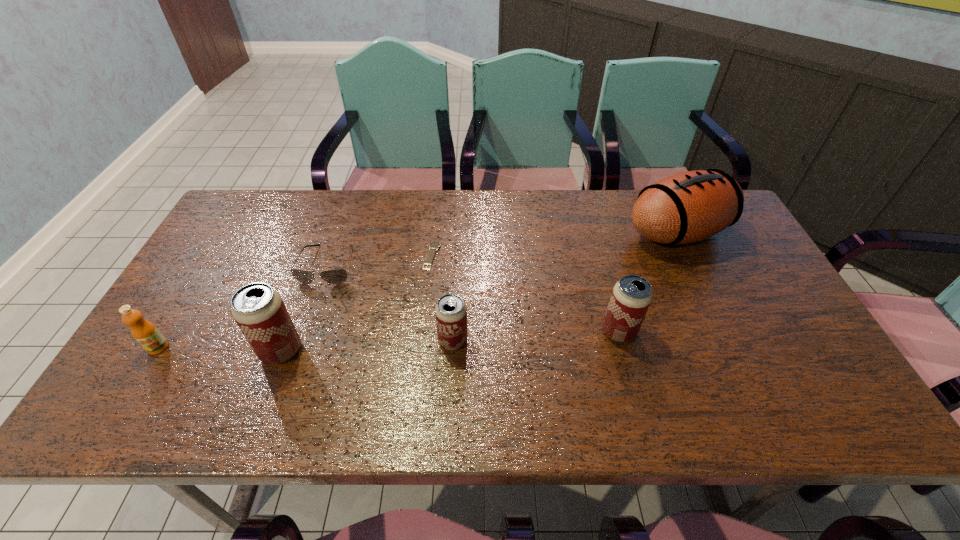
Where is `the leftmost beer can`? The image size is (960, 540). the leftmost beer can is located at coordinates (259, 311).

You are a GUI agent. You are given a task and a screenshot of the screen. Output one action in this format:
    pyautogui.click(x=<x>, y=<y>)
    Task: Click on the fifth object from left to right
    
    Given the screenshot: What is the action you would take?
    pyautogui.click(x=451, y=313)

At what (x,y) coordinates should I click in order to perform the action: click on the shortest beer can. Please return your answer as a coordinate pair (x, y). Looking at the image, I should click on (451, 313).

Locate an element on the screen. This screenshot has height=540, width=960. the rightmost beer can is located at coordinates (631, 296).

You are a GUI agent. You are given a task and a screenshot of the screen. Output one action in this format:
    pyautogui.click(x=<x>, y=<y>)
    Task: Click on the second shortest beer can
    Image resolution: width=960 pixels, height=540 pixels.
    Given the screenshot: What is the action you would take?
    pyautogui.click(x=631, y=296)

You are a GUI agent. You are given a task and a screenshot of the screen. Output one action in this format:
    pyautogui.click(x=<x>, y=<y>)
    Task: Click on the watch
    The height and width of the screenshot is (540, 960).
    Given the screenshot: What is the action you would take?
    pyautogui.click(x=434, y=245)

I want to click on the shortest object, so click(434, 245).

Find the location of `football (American)`. football (American) is located at coordinates (687, 207).

Locate an element on the screen. sunglasses is located at coordinates (335, 276).

This screenshot has width=960, height=540. What are the coordinates of `orange juice` in the screenshot? It's located at (146, 334).